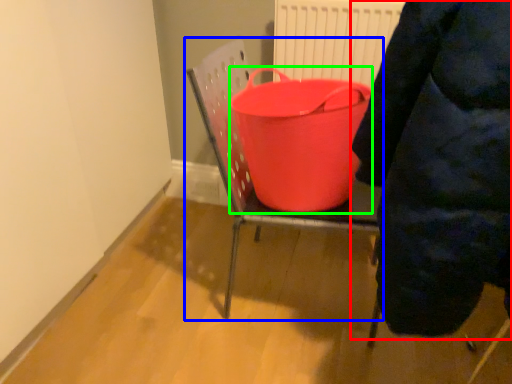
Question: Considering the real-world distances, which object is closest to person (highlighted by a red box)? furniture (highlighted by a blue box) or basin (highlighted by a green box).

Choices:
 (A) furniture
 (B) basin

Answer: (B)